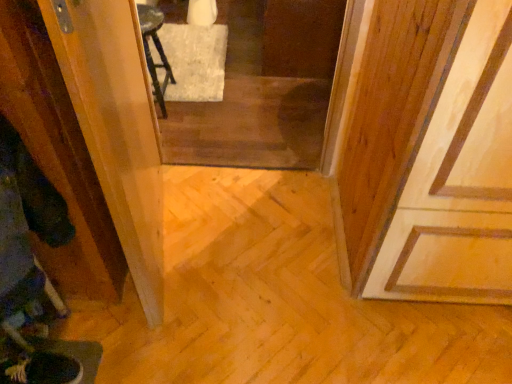
Where is `free space on the front side of transparent plastic screen door at left, the second screen door in the back-to-front sequence`? The width and height of the screenshot is (512, 384). free space on the front side of transparent plastic screen door at left, the second screen door in the back-to-front sequence is located at coordinates click(163, 327).